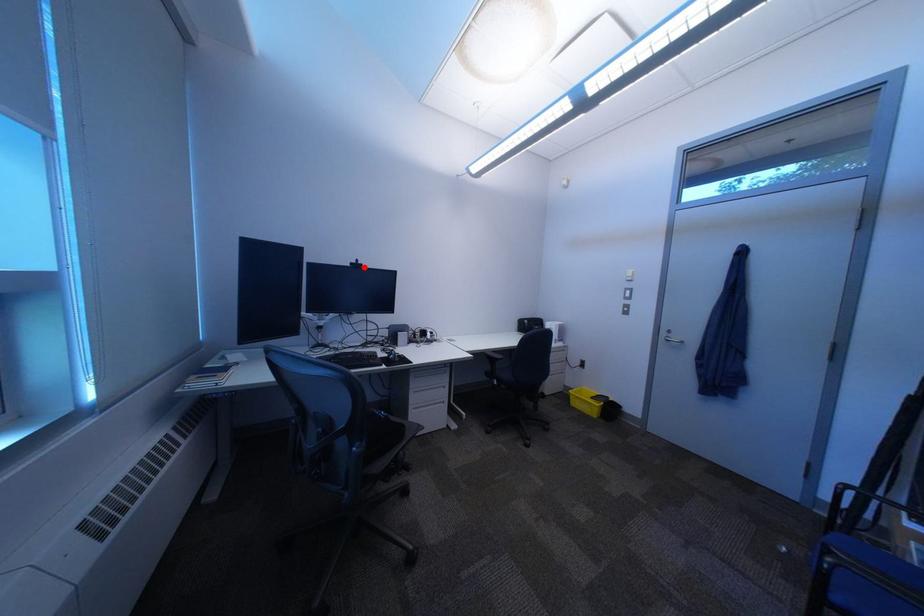
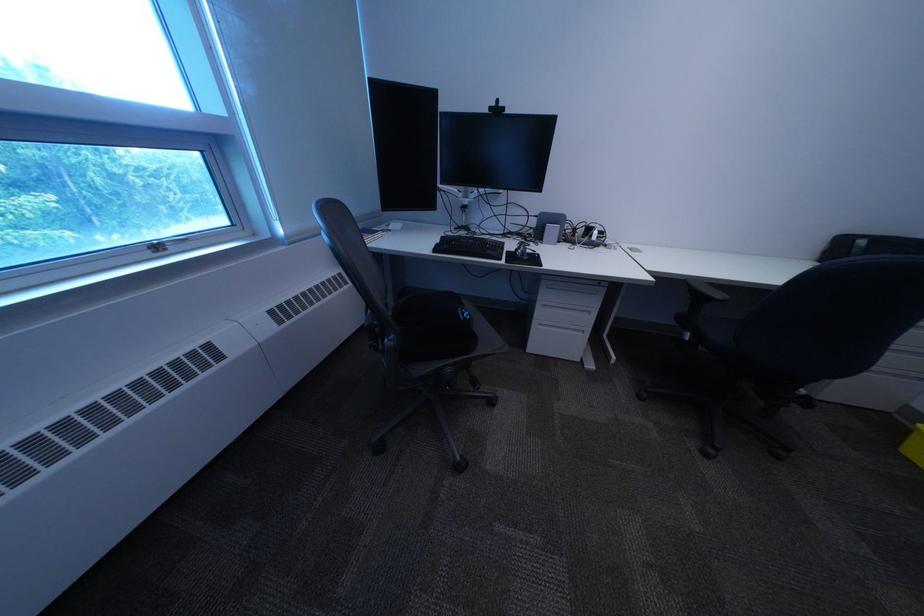
Locate, in the second image, the point that corresponds to the highlighted location in the first image.

(503, 113)